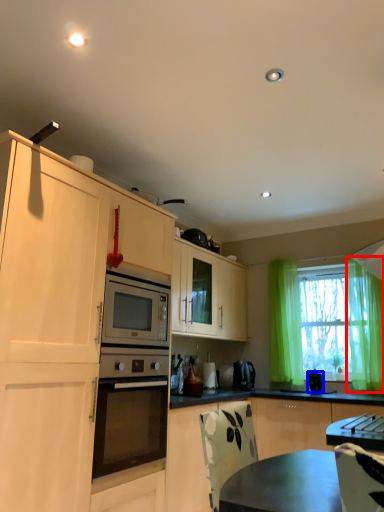
Question: Which object is further to the camera taking this photo, curtain (highlighted by a red box) or appliance (highlighted by a blue box)?

Choices:
 (A) curtain
 (B) appliance

Answer: (B)